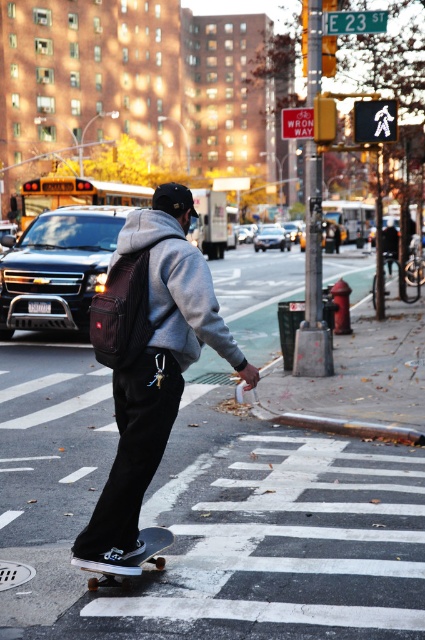
You are a delivery person who needs to place both the matte black backpack at center and the black matte skateboard at lower center into a storage locker. The locker has a maximum width of 28 inches. Can both items fit side by side without overlapping?

The matte black backpack at center and black matte skateboard at lower center are 27.93 inches apart, so they can fit side by side in the locker since the total width is less than the 28 inches maximum.